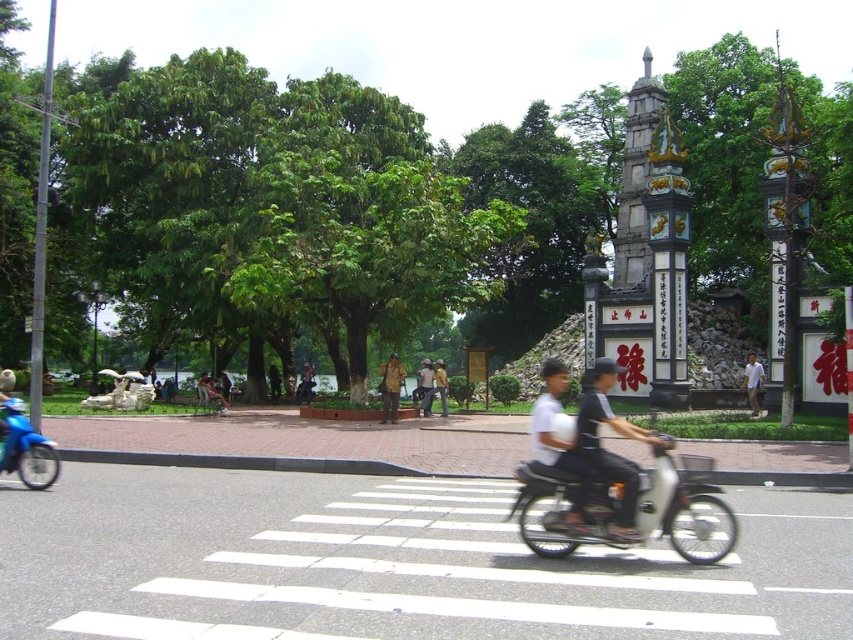
Who is higher up, metallic silver motorcycle at center or dark gray fabric shirt at center?

dark gray fabric shirt at center is above.

Describe the element at coordinates (633, 508) in the screenshot. Image resolution: width=853 pixels, height=640 pixels. I see `metallic silver motorcycle at center` at that location.

Consider the image. Who is more distant from viewer, (517, 524) or (608, 474)?

The point (517, 524) is more distant.

Where is `metallic silver motorcycle at center`? This screenshot has height=640, width=853. metallic silver motorcycle at center is located at coordinates click(633, 508).

Is metallic silver motorcycle at center below white cotton shirt at center?

Indeed, metallic silver motorcycle at center is positioned under white cotton shirt at center.

Is metallic silver motorcycle at center positioned in front of white cotton shirt at center?

Yes, metallic silver motorcycle at center is closer to the viewer.

Is point (561, 481) positioned in front of point (741, 385)?

That is True.

At what (x,y) coordinates should I click in order to perform the action: click on metallic silver motorcycle at center. Please return your answer as a coordinate pair (x, y). The width and height of the screenshot is (853, 640). Looking at the image, I should click on (633, 508).

Is point (395, 400) farther from viewer compared to point (444, 387)?

No.

Which is above, yellow fabric jacket at center or yellow fabric shirt at center?

yellow fabric jacket at center

Who is more forward, (386, 420) or (437, 388)?

Point (386, 420) is in front.

Where is `yellow fabric jacket at center`? The height and width of the screenshot is (640, 853). yellow fabric jacket at center is located at coordinates (390, 387).